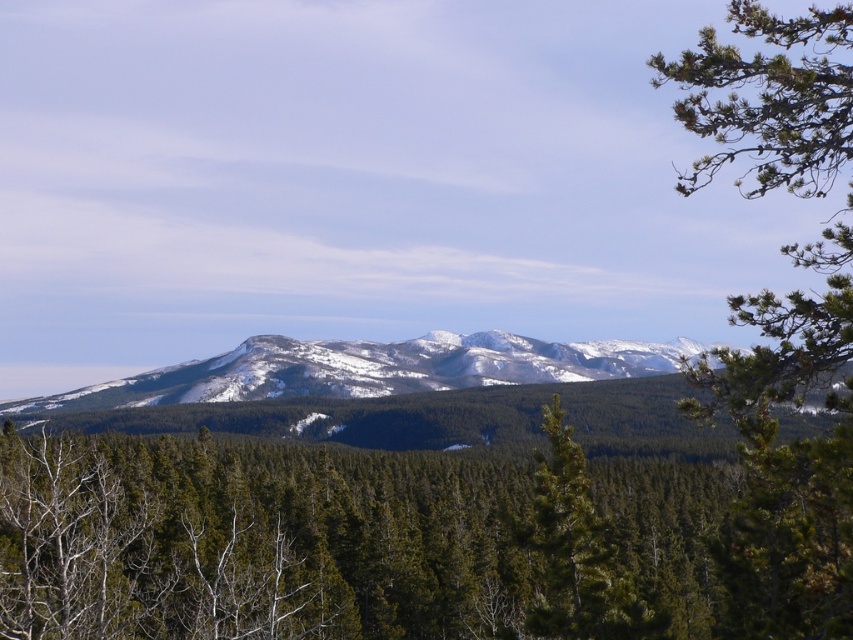
Question: Estimate the real-world distances between objects in this image. Which object is closer to the snowy rocky mountain range at center?

Choices:
 (A) green matte tree at center
 (B) green needle-like branches at upper right

Answer: (B)

Question: Considering the relative positions of green needle-like branches at upper right and snowy rocky mountain range at center in the image provided, where is green needle-like branches at upper right located with respect to snowy rocky mountain range at center?

Choices:
 (A) below
 (B) above

Answer: (B)

Question: Does green needle-like branches at upper right lie behind green matte tree at center?

Choices:
 (A) yes
 (B) no

Answer: (B)

Question: Which object appears farthest from the camera in this image?

Choices:
 (A) snowy rocky mountain range at center
 (B) green needle-like branches at upper right
 (C) green matte tree at center

Answer: (A)

Question: Which point is closer to the camera?

Choices:
 (A) snowy rocky mountain range at center
 (B) green needle-like branches at upper right
 (C) green matte tree at center

Answer: (B)

Question: Is the position of snowy rocky mountain range at center more distant than that of green matte tree at center?

Choices:
 (A) no
 (B) yes

Answer: (B)